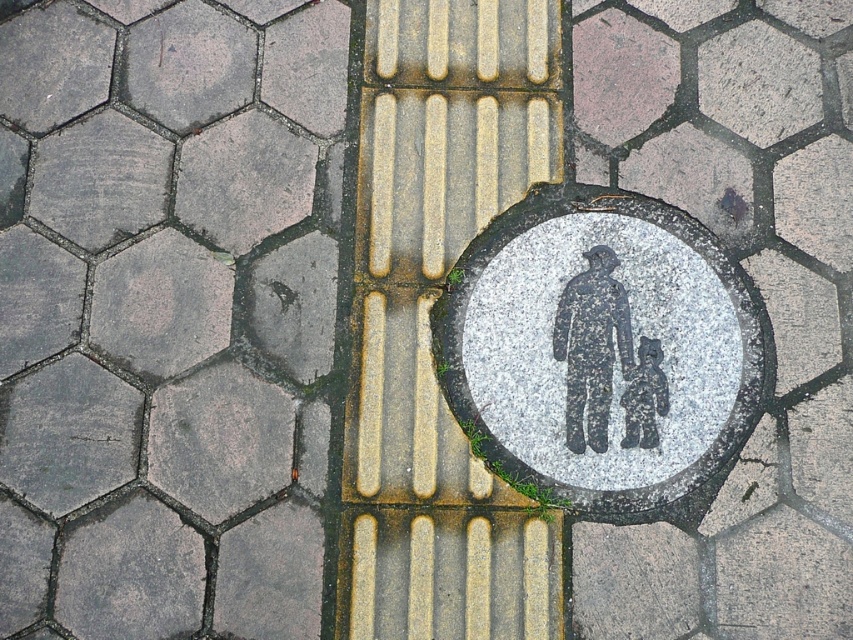
Does granite circle at center lie behind black textured figure at center?

No, it is in front of black textured figure at center.

Image resolution: width=853 pixels, height=640 pixels. What do you see at coordinates (604, 355) in the screenshot? I see `granite circle at center` at bounding box center [604, 355].

At what (x,y) coordinates should I click in order to perform the action: click on granite circle at center. Please return your answer as a coordinate pair (x, y). The width and height of the screenshot is (853, 640). Looking at the image, I should click on (604, 355).

Who is taller, black textured figure at center or dark gray stone figure at center?

With more height is black textured figure at center.

Is black textured figure at center behind dark gray stone figure at center?

No, black textured figure at center is in front of dark gray stone figure at center.

This screenshot has height=640, width=853. In order to click on black textured figure at center in this screenshot , I will do `click(590, 346)`.

I want to click on granite circle at center, so click(x=604, y=355).

Which is below, granite circle at center or dark gray stone figure at center?

dark gray stone figure at center is below.

Does point (520, 301) come farther from viewer compared to point (646, 413)?

Yes, it is behind point (646, 413).

Identify the location of granite circle at center. (604, 355).